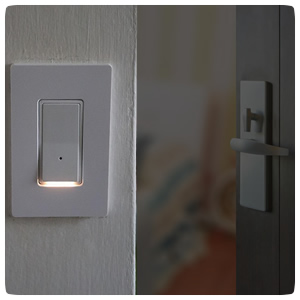
Identify the location of light switch. This screenshot has height=300, width=300. (68, 126).